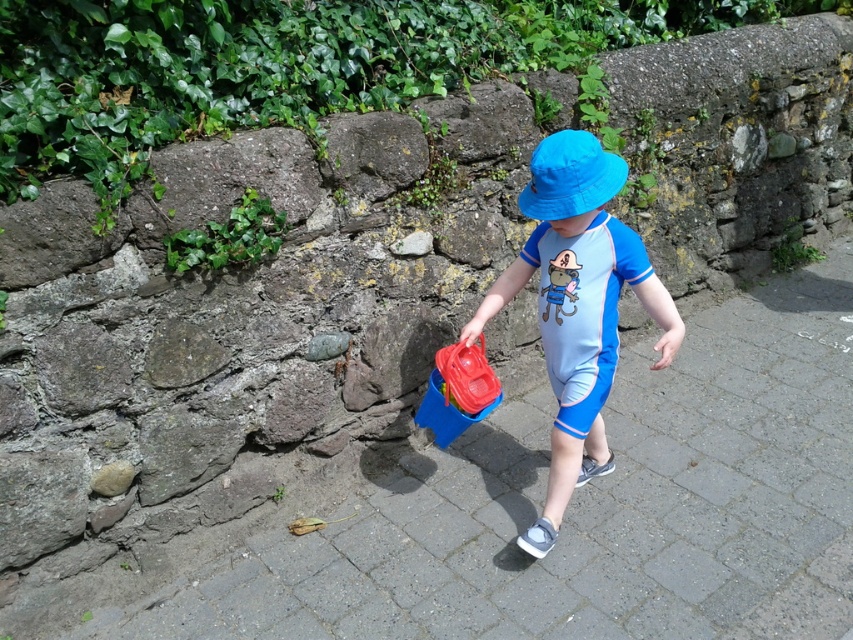
Does blue paved stone at center have a lesser height compared to blue matte swimsuit at center?

Incorrect, blue paved stone at center's height does not fall short of blue matte swimsuit at center's.

Is blue paved stone at center further to the viewer compared to blue matte swimsuit at center?

No.

Who is more forward, (509, 506) or (489, 310)?

Point (489, 310) is in front.

Image resolution: width=853 pixels, height=640 pixels. I want to click on blue paved stone at center, so click(590, 508).

Which of these two, blue matte swimsuit at center or blue fabric hat at center, stands taller?

blue matte swimsuit at center is taller.

Is point (589, 467) more distant than point (587, 204)?

Yes, it is behind point (587, 204).

Where is `blue matte swimsuit at center`? The image size is (853, 640). blue matte swimsuit at center is located at coordinates (577, 307).

Does blue paved stone at center appear on the right side of blue fabric hat at center?

Indeed, blue paved stone at center is positioned on the right side of blue fabric hat at center.

Between blue paved stone at center and blue fabric hat at center, which one appears on the right side from the viewer's perspective?

Positioned to the right is blue paved stone at center.

In order to click on blue paved stone at center in this screenshot , I will do `click(590, 508)`.

Find the location of `blue paved stone at center`. blue paved stone at center is located at coordinates (590, 508).